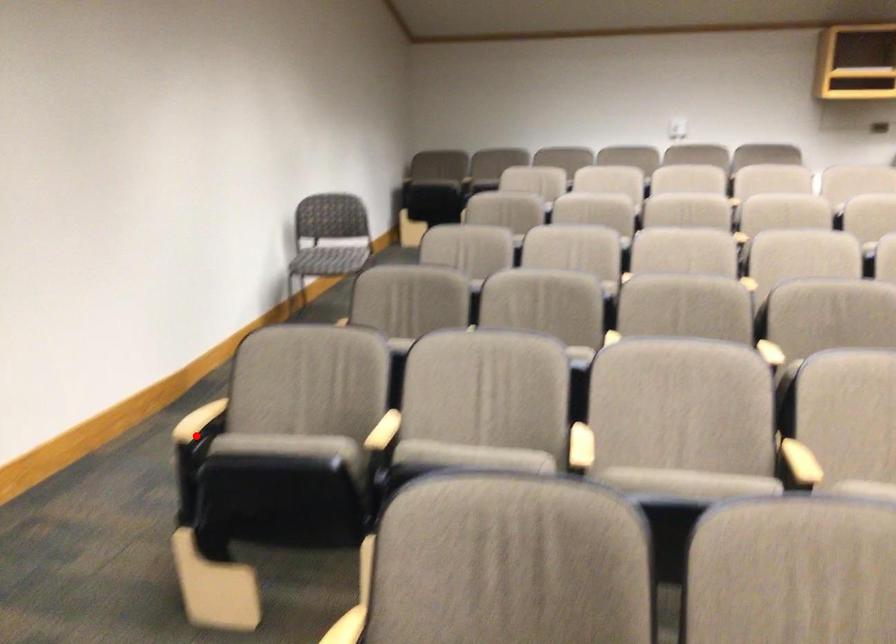
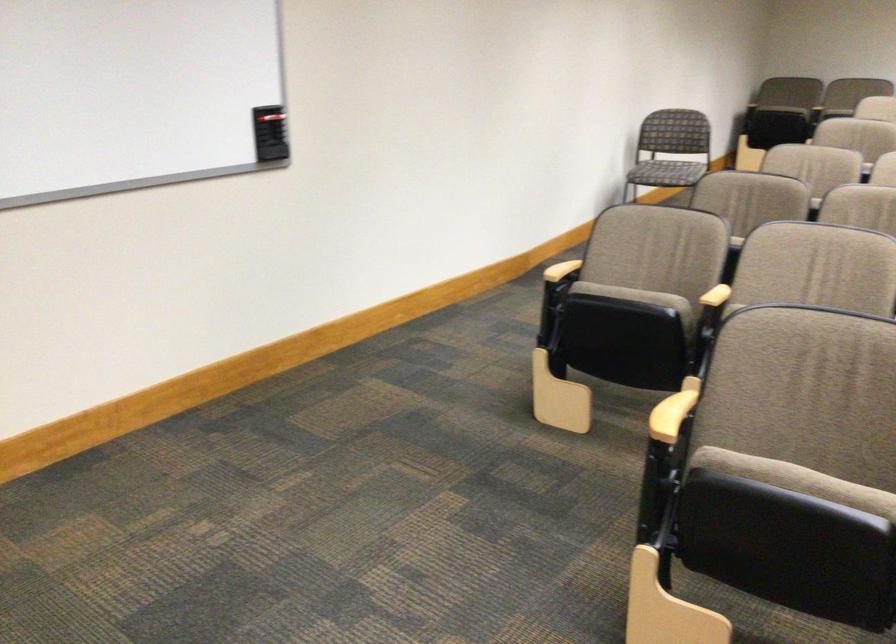
Question: I am providing you with two images of the same scene from different viewpoints. Image1 has a red point marked. In image2, the corresponding 3D location appears at what relative position? Reply with the corresponding letter.

Choices:
 (A) Closer
 (B) Farther

Answer: (B)